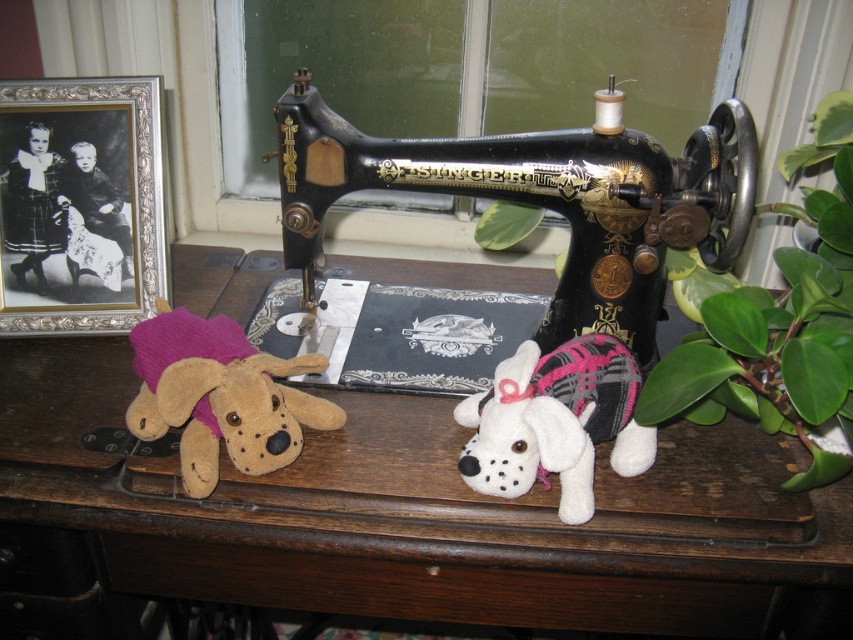
Locate an element on the screen. black polished wood sewing machine at center is located at coordinates (543, 198).

Can you confirm if black polished wood sewing machine at center is shorter than green leafy plant at right?

Yes, black polished wood sewing machine at center is shorter than green leafy plant at right.

Is point (643, 296) behind point (770, 417)?

Yes, it is behind point (770, 417).

You are a GUI agent. You are given a task and a screenshot of the screen. Output one action in this format:
    pyautogui.click(x=<x>, y=<y>)
    Task: Click on the black polished wood sewing machine at center
    The height and width of the screenshot is (640, 853).
    Given the screenshot: What is the action you would take?
    pyautogui.click(x=543, y=198)

Does fuzzy brown stuffed dog at left have a greater height compared to white plush dog at center?

Correct, fuzzy brown stuffed dog at left is much taller as white plush dog at center.

Between fuzzy brown stuffed dog at left and white plush dog at center, which one has less height?

white plush dog at center

Is point (207, 396) positioned after point (627, 454)?

No.

The image size is (853, 640). What are the coordinates of `fuzzy brown stuffed dog at left` in the screenshot? It's located at (219, 396).

Based on the photo, who is positioned more to the right, silver/glass picture frame at upper left or white plush dog at center?

white plush dog at center

Measure the distance between silver/glass picture frame at upper left and camera.

silver/glass picture frame at upper left is 1.03 meters away from camera.

Identify the location of silver/glass picture frame at upper left. The height and width of the screenshot is (640, 853). point(80,204).